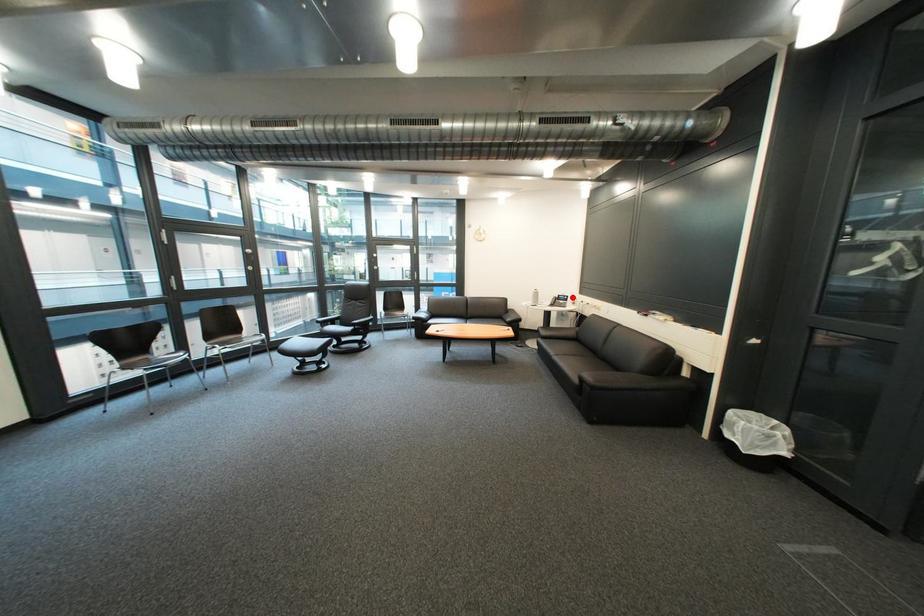
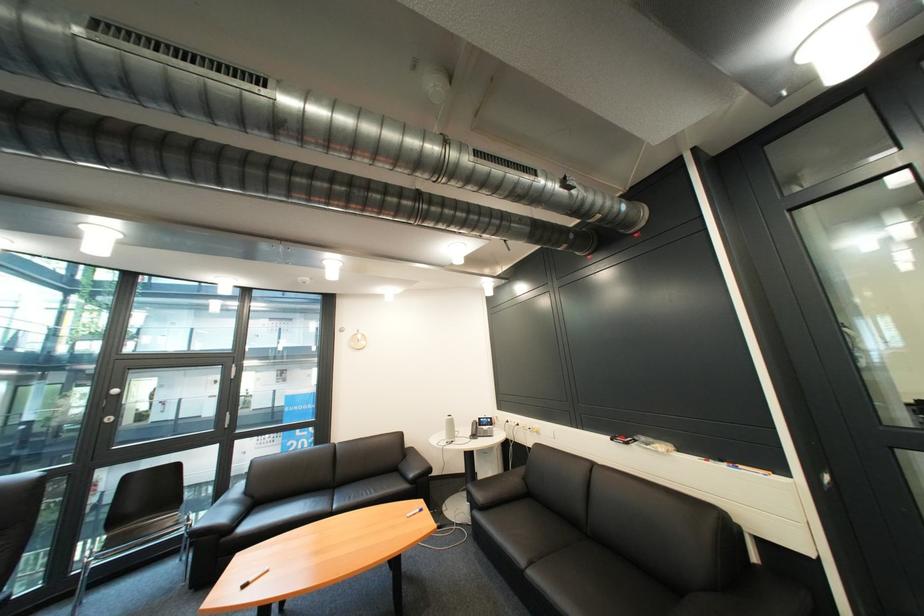
Question: I am providing you with two images of the same scene from different viewpoints. Given a red point in image1, look at the same physical point in image2. Is it:

Choices:
 (A) Closer to the viewpoint
 (B) Farther from the viewpoint

Answer: (B)